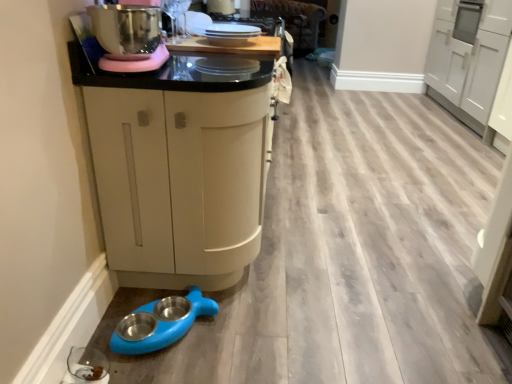
Question: Can you confirm if transparent glass bowl at lower left, acting as the second appliance starting from the top, is thinner than blue rubber pet bowls at lower left?

Choices:
 (A) yes
 (B) no

Answer: (A)

Question: Is transparent glass bowl at lower left, which is counted as the first appliance, starting from the bottom, facing away from blue rubber pet bowls at lower left?

Choices:
 (A) yes
 (B) no

Answer: (B)

Question: Considering the relative sizes of transparent glass bowl at lower left, which is the second appliance from right to left, and blue rubber pet bowls at lower left in the image provided, is transparent glass bowl at lower left, which is the second appliance from right to left, shorter than blue rubber pet bowls at lower left?

Choices:
 (A) yes
 (B) no

Answer: (A)

Question: Is transparent glass bowl at lower left, positioned as the 1th appliance in front-to-back order, next to blue rubber pet bowls at lower left?

Choices:
 (A) yes
 (B) no

Answer: (B)

Question: Is transparent glass bowl at lower left, positioned as the 1th appliance in front-to-back order, smaller than blue rubber pet bowls at lower left?

Choices:
 (A) yes
 (B) no

Answer: (A)

Question: Looking at the image, does white glossy plates at upper center, positioned as the first appliance in top-to-bottom order, seem bigger or smaller compared to blue rubber pet bowls at lower left?

Choices:
 (A) small
 (B) big

Answer: (A)

Question: From the image's perspective, is white glossy plates at upper center, which is the 1th appliance in right-to-left order, above or below blue rubber pet bowls at lower left?

Choices:
 (A) below
 (B) above

Answer: (B)

Question: From a real-world perspective, is white glossy plates at upper center, placed as the second appliance when sorted from bottom to top, positioned above or below blue rubber pet bowls at lower left?

Choices:
 (A) below
 (B) above

Answer: (B)

Question: In the image, is white glossy plates at upper center, positioned as the first appliance in top-to-bottom order, positioned in front of or behind blue rubber pet bowls at lower left?

Choices:
 (A) front
 (B) behind

Answer: (B)

Question: Considering their positions, is white glossy plates at upper center, placed as the second appliance when sorted from bottom to top, located in front of or behind wooden surface at upper center?

Choices:
 (A) behind
 (B) front

Answer: (B)

Question: Is point (239, 29) closer or farther from the camera than point (236, 46)?

Choices:
 (A) farther
 (B) closer

Answer: (A)

Question: In terms of size, does white glossy plates at upper center, which is the 1th appliance in right-to-left order, appear bigger or smaller than wooden surface at upper center?

Choices:
 (A) small
 (B) big

Answer: (A)

Question: Considering the positions of white glossy plates at upper center, placed as the second appliance when sorted from bottom to top, and wooden surface at upper center in the image, is white glossy plates at upper center, placed as the second appliance when sorted from bottom to top, taller or shorter than wooden surface at upper center?

Choices:
 (A) short
 (B) tall

Answer: (B)

Question: From a real-world perspective, is wooden surface at upper center physically located above or below white glossy plates at upper center, positioned as the first appliance in top-to-bottom order?

Choices:
 (A) below
 (B) above

Answer: (A)

Question: Is wooden surface at upper center spatially inside white glossy plates at upper center, which ranks as the 2th appliance in front-to-back order, or outside of it?

Choices:
 (A) outside
 (B) inside

Answer: (A)